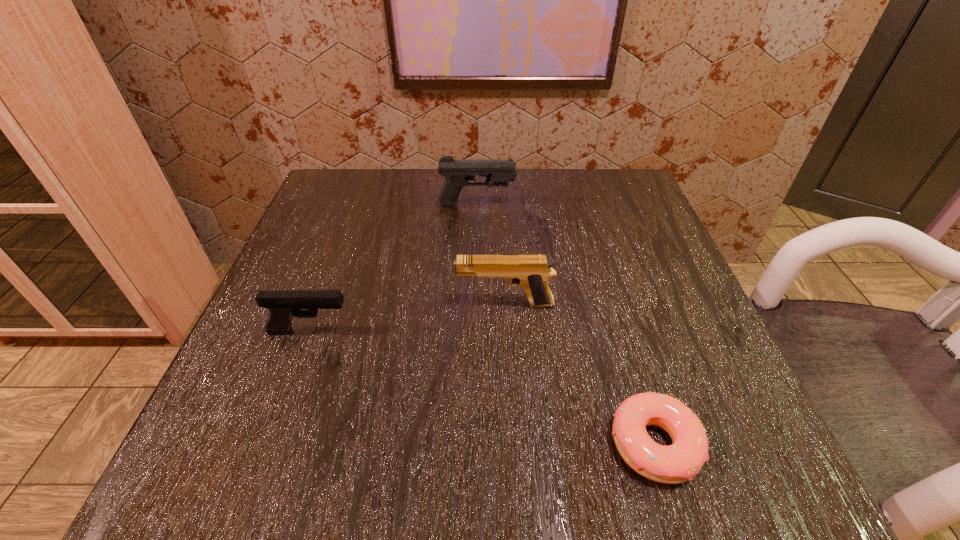
Where is `the farthest object`? The height and width of the screenshot is (540, 960). the farthest object is located at coordinates (457, 172).

Locate an element on the screen. the second nearest pistol is located at coordinates (531, 272).

I want to click on the leftmost pistol, so click(283, 304).

Where is `the third farthest object`? Image resolution: width=960 pixels, height=540 pixels. the third farthest object is located at coordinates (283, 304).

Identify the location of the shortest object. The image size is (960, 540). (677, 463).

Find the location of `the nearest object`. the nearest object is located at coordinates (677, 463).

Identify the location of free location located at the barrel of the farthest pistol. Image resolution: width=960 pixels, height=540 pixels. (550, 205).

Locate an element on the screen. This screenshot has height=540, width=960. free space located 0.080m at the barrel of the second farthest pistol is located at coordinates (410, 304).

Find the location of `blank area located 0.290m at the barrel of the second farthest pistol`. blank area located 0.290m at the barrel of the second farthest pistol is located at coordinates (289, 304).

This screenshot has height=540, width=960. I want to click on vacant position located at the barrel of the second farthest pistol, so click(272, 304).